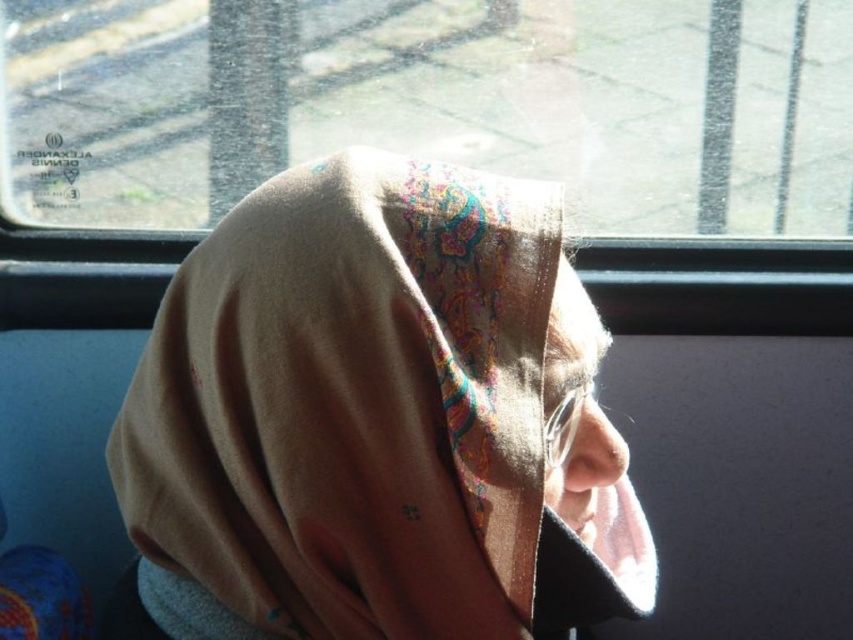
You are a passenger on a bus and want to look outside through the transparent glass at upper center. Is the beige fabric headscarf at center blocking your view?

The beige fabric headscarf at center is in front of transparent glass at upper center, so it is blocking the view through the transparent glass at upper center.

You are a passenger on a bus and want to see the scenery outside through the transparent glass at upper center. However, the beige fabric headscarf at center is blocking your view. Which direction should you move your head to see the scenery better?

The beige fabric headscarf at center is positioned on the right side of the transparent glass at upper center. To see the scenery better, you should move your head to the left to avoid the obstruction caused by the beige fabric headscarf at center.

You are a photographer trying to capture the reflection of the window sticker on the glasses of the person wearing the beige fabric headscarf at center. Considering the size of the transparent glass at upper center, will the reflection of the sticker be visible on the glasses?

The beige fabric headscarf at center has a lesser width compared to transparent glass at upper center. Since the transparent glass at upper center is wider, its reflection on the glasses might be large enough to include the sticker, so the reflection of the sticker could be visible on the glasses.